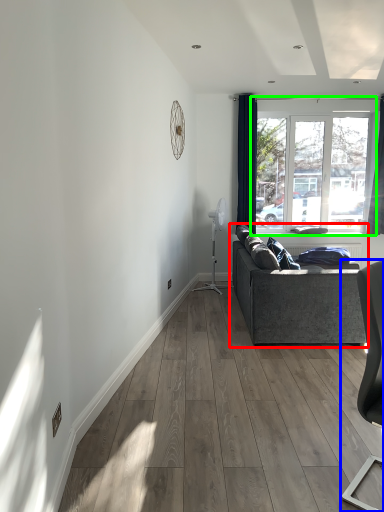
Question: Which is farther away from studio couch (highlighted by a red box)? chair (highlighted by a blue box) or window (highlighted by a green box)?

Choices:
 (A) chair
 (B) window

Answer: (B)